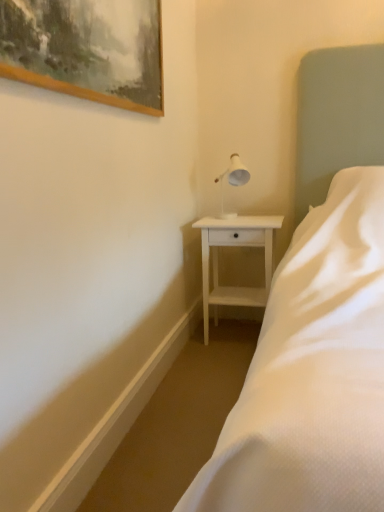
Question: Does white satin bed at center have a greater height compared to white wood nightstand at center?

Choices:
 (A) yes
 (B) no

Answer: (A)

Question: From the image's perspective, is white satin bed at center above white wood nightstand at center?

Choices:
 (A) yes
 (B) no

Answer: (A)

Question: Would you say white satin bed at center is outside white wood nightstand at center?

Choices:
 (A) yes
 (B) no

Answer: (A)

Question: Considering the relative sizes of white satin bed at center and white wood nightstand at center in the image provided, is white satin bed at center smaller than white wood nightstand at center?

Choices:
 (A) no
 (B) yes

Answer: (A)

Question: Are white satin bed at center and white wood nightstand at center beside each other?

Choices:
 (A) yes
 (B) no

Answer: (B)

Question: Would you say white satin bed at center is a long distance from white wood nightstand at center?

Choices:
 (A) yes
 (B) no

Answer: (B)

Question: Considering the relative sizes of white satin bed at center and wooden picture frame at upper left in the image provided, is white satin bed at center wider than wooden picture frame at upper left?

Choices:
 (A) no
 (B) yes

Answer: (B)

Question: From the image's perspective, is white satin bed at center beneath wooden picture frame at upper left?

Choices:
 (A) no
 (B) yes

Answer: (B)

Question: Is white satin bed at center smaller than wooden picture frame at upper left?

Choices:
 (A) no
 (B) yes

Answer: (A)

Question: Does white satin bed at center appear on the right side of wooden picture frame at upper left?

Choices:
 (A) yes
 (B) no

Answer: (A)

Question: From a real-world perspective, is white satin bed at center under wooden picture frame at upper left?

Choices:
 (A) no
 (B) yes

Answer: (B)

Question: From the image's perspective, is white satin bed at center on wooden picture frame at upper left?

Choices:
 (A) no
 (B) yes

Answer: (A)

Question: From a real-world perspective, is wooden picture frame at upper left below white satin bed at center?

Choices:
 (A) yes
 (B) no

Answer: (B)